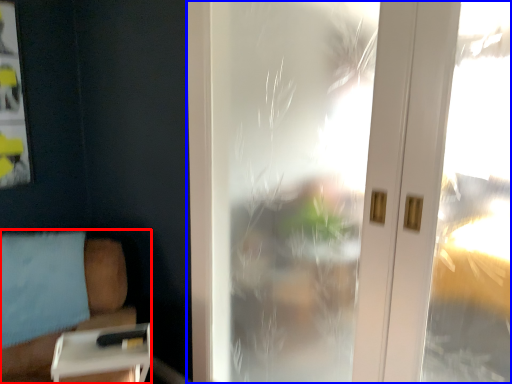
Question: Which object is further to the camera taking this photo, furniture (highlighted by a red box) or window (highlighted by a blue box)?

Choices:
 (A) furniture
 (B) window

Answer: (B)